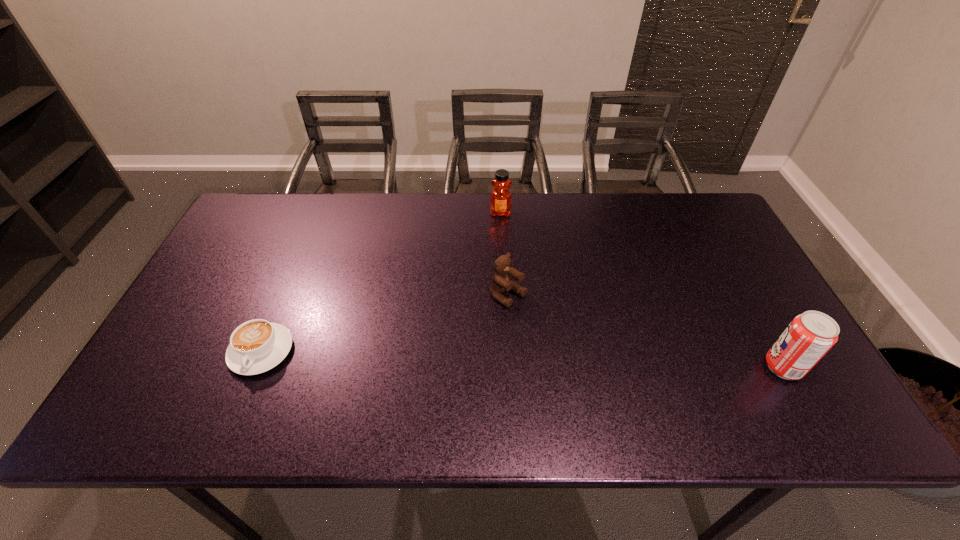
In order to click on cappuccino in this screenshot , I will do `click(256, 346)`.

Identify the location of the leftmost object. This screenshot has width=960, height=540. (256, 346).

Image resolution: width=960 pixels, height=540 pixels. Identify the location of the rightmost object. (809, 336).

The width and height of the screenshot is (960, 540). Identify the location of honey. (500, 200).

Where is `the second farthest object`? The image size is (960, 540). the second farthest object is located at coordinates (501, 282).

Find the location of `the third tallest object`. the third tallest object is located at coordinates (501, 282).

The image size is (960, 540). Find the location of `vacant region located on the back of the soda can`. vacant region located on the back of the soda can is located at coordinates (723, 258).

This screenshot has width=960, height=540. Identify the location of vacant space located 0.080m on the front label of the honey. (500, 235).

What are the coordinates of `blank space located 0.060m on the front label of the honey` in the screenshot? It's located at (500, 231).

At what (x,y) coordinates should I click in order to perform the action: click on vacant area situated on the front label of the honey. Please return your answer as a coordinate pair (x, y). Image resolution: width=960 pixels, height=540 pixels. Looking at the image, I should click on (497, 313).